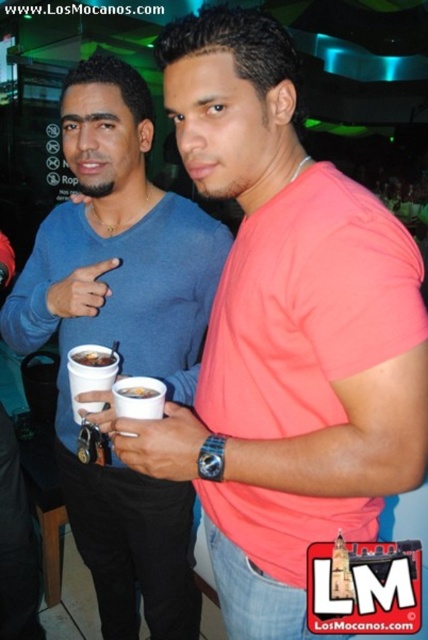
What do you see at coordinates (91, 376) in the screenshot? I see `white paper cup at center` at bounding box center [91, 376].

At what (x,y) coordinates should I click in order to perform the action: click on white paper cup at center. Please return your answer as a coordinate pair (x, y). The width and height of the screenshot is (428, 640). Looking at the image, I should click on (91, 376).

Is blue matte shirt at center below white matte cup at center?

Yes, blue matte shirt at center is below white matte cup at center.

Does point (65, 252) come farther from viewer compared to point (133, 394)?

Yes, point (65, 252) is farther from viewer.

Which is in front, point (121, 484) or point (142, 392)?

Positioned in front is point (142, 392).

What are the coordinates of `blue matte shirt at center` in the screenshot? It's located at (121, 337).

Is blue matte shirt at center positioned in front of white paper cup at center?

Yes, blue matte shirt at center is in front of white paper cup at center.

What do you see at coordinates (121, 337) in the screenshot? I see `blue matte shirt at center` at bounding box center [121, 337].

Does point (154, 332) lie in front of point (73, 417)?

Yes, it is.

The height and width of the screenshot is (640, 428). Find the location of `blue matte shirt at center`. blue matte shirt at center is located at coordinates (121, 337).